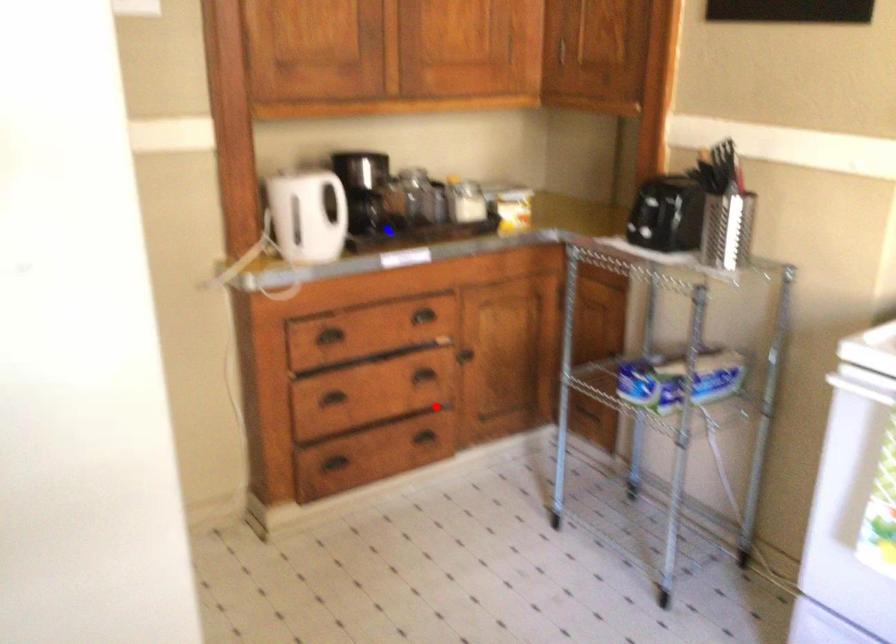
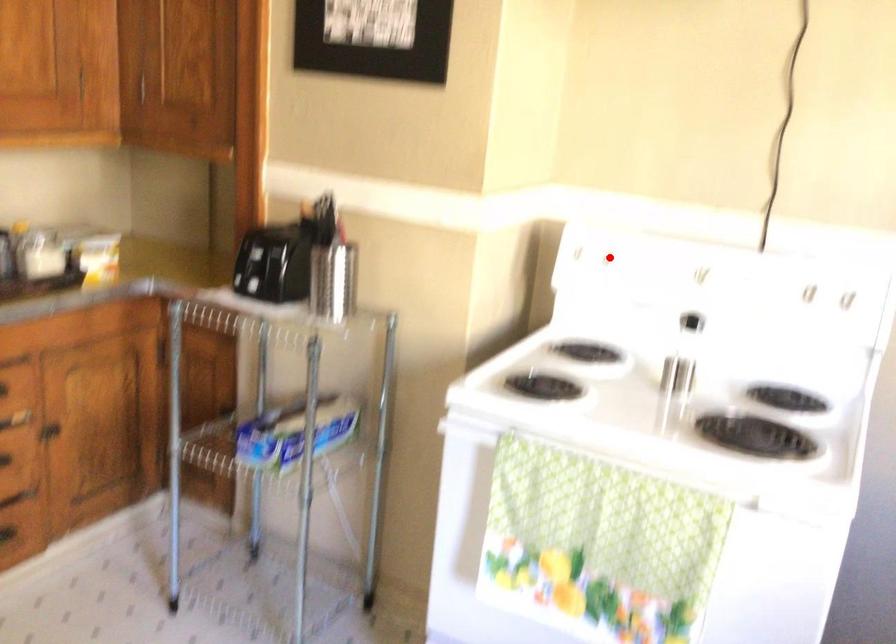
I am providing you with two images of the same scene from different viewpoints. A red point is marked on the first image and another point is marked on the second image. Is the marked point in image1 the same physical position as the marked point in image2?

No